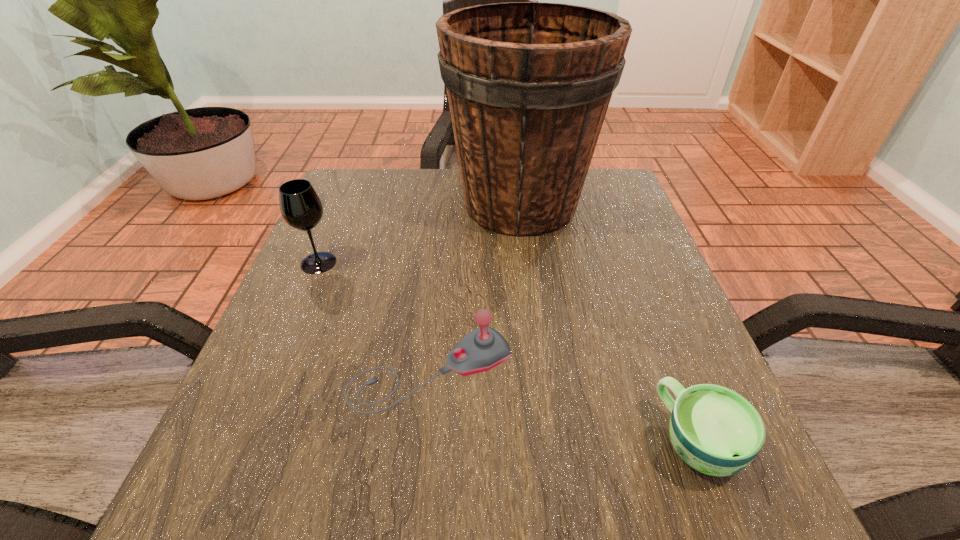
Identify the location of the tallest object. (528, 84).

The image size is (960, 540). What are the coordinates of `bucket` in the screenshot? It's located at click(x=528, y=84).

What are the coordinates of `the second farthest object` in the screenshot? It's located at (301, 208).

Locate an element on the screen. The height and width of the screenshot is (540, 960). the leftmost object is located at coordinates (301, 208).

The image size is (960, 540). What are the coordinates of `the second shortest object` in the screenshot? It's located at (484, 348).

Identify the location of the shortest object. The width and height of the screenshot is (960, 540). (716, 431).

Image resolution: width=960 pixels, height=540 pixels. What are the coordinates of `vacant space situated on the left of the farthest object` in the screenshot? It's located at (426, 205).

At what (x,y) coordinates should I click in order to perform the action: click on free space located on the right of the second farthest object. Please return your answer as a coordinate pair (x, y). The height and width of the screenshot is (540, 960). Looking at the image, I should click on (458, 262).

You are a GUI agent. You are given a task and a screenshot of the screen. Output one action in this format:
    pyautogui.click(x=<x>, y=<y>)
    Task: Click on the vacant space located on the back of the joystick
    The width and height of the screenshot is (960, 540).
    Given the screenshot: What is the action you would take?
    pyautogui.click(x=437, y=312)

Find the location of a particular element. vacant space located 0.250m on the left of the cup is located at coordinates (481, 441).